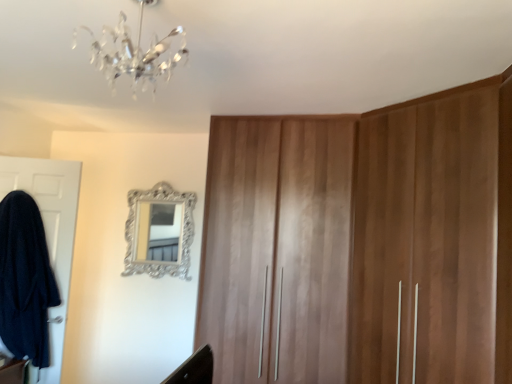
Image resolution: width=512 pixels, height=384 pixels. In order to click on free point above silver ornate mirror at upper center (from a real-world perspective) in this screenshot , I will do `click(158, 182)`.